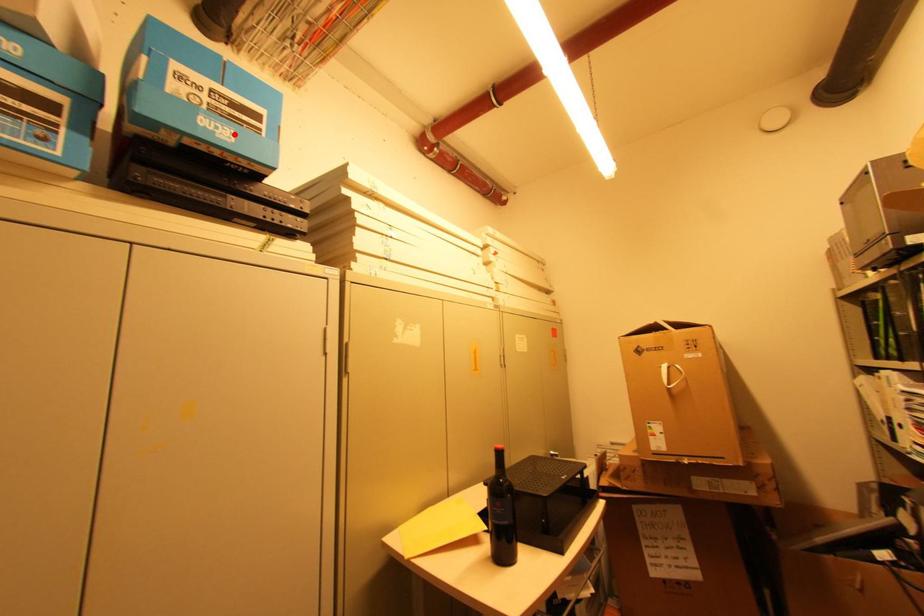
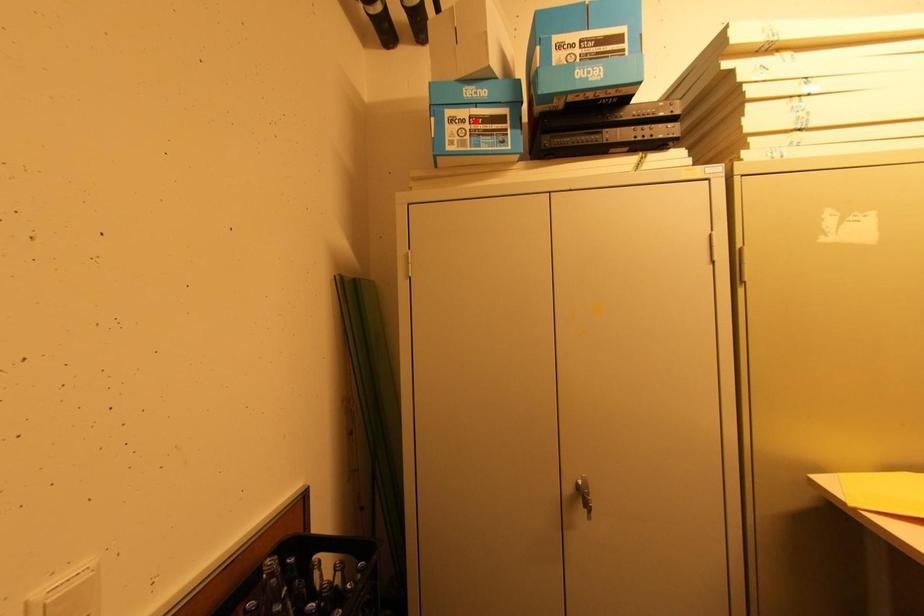
I am providing you with two images of the same scene from different viewpoints. A red point is marked on the first image and another point is marked on the second image. Is the marked point in image1 the same physical position as the marked point in image2?

No